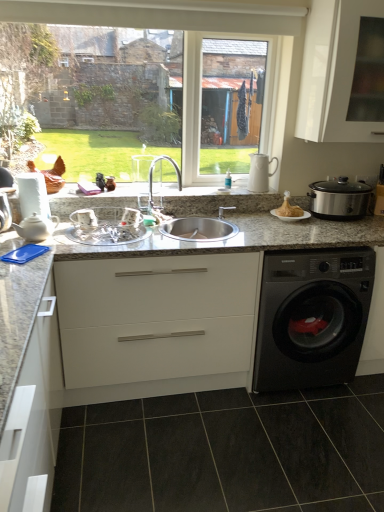
Question: Does white matte cabinet at center, acting as the 2th cabinetry starting from the left, come in front of golden crispy turkey at center?

Choices:
 (A) yes
 (B) no

Answer: (A)

Question: Is white matte cabinet at center, acting as the 2th cabinetry starting from the left, outside of golden crispy turkey at center?

Choices:
 (A) yes
 (B) no

Answer: (A)

Question: Does white matte cabinet at center, acting as the 2th cabinetry starting from the left, appear on the right side of golden crispy turkey at center?

Choices:
 (A) no
 (B) yes

Answer: (A)

Question: Is white matte cabinet at center, the second cabinetry from the right, beside golden crispy turkey at center?

Choices:
 (A) no
 (B) yes

Answer: (A)

Question: Does white matte cabinet at center, the second cabinetry from the right, have a greater width compared to golden crispy turkey at center?

Choices:
 (A) no
 (B) yes

Answer: (B)

Question: From the image's perspective, is white matte cabinet at center, the second cabinetry from the right, above golden crispy turkey at center?

Choices:
 (A) yes
 (B) no

Answer: (B)

Question: Does white ceramic pitcher at upper right, the 2th appliance from the right, appear on the right side of stainless steel slow cooker at right, the 1th appliance viewed from the right?

Choices:
 (A) yes
 (B) no

Answer: (B)

Question: Is white ceramic pitcher at upper right, the second appliance in the left-to-right sequence, at the left side of stainless steel slow cooker at right, placed as the third appliance when sorted from left to right?

Choices:
 (A) no
 (B) yes

Answer: (B)

Question: From the image's perspective, is white ceramic pitcher at upper right, the 2th appliance from the right, under stainless steel slow cooker at right, placed as the third appliance when sorted from left to right?

Choices:
 (A) yes
 (B) no

Answer: (B)

Question: Can you confirm if white ceramic pitcher at upper right, the second appliance in the left-to-right sequence, is bigger than stainless steel slow cooker at right, placed as the third appliance when sorted from left to right?

Choices:
 (A) no
 (B) yes

Answer: (A)

Question: From a real-world perspective, is white ceramic pitcher at upper right, the second appliance in the left-to-right sequence, below stainless steel slow cooker at right, placed as the third appliance when sorted from left to right?

Choices:
 (A) yes
 (B) no

Answer: (B)

Question: Considering the relative sizes of silver metallic faucet at center and white matte cabinet at lower left, which is the first cabinetry from left to right, in the image provided, is silver metallic faucet at center shorter than white matte cabinet at lower left, which is the first cabinetry from left to right,?

Choices:
 (A) no
 (B) yes

Answer: (B)